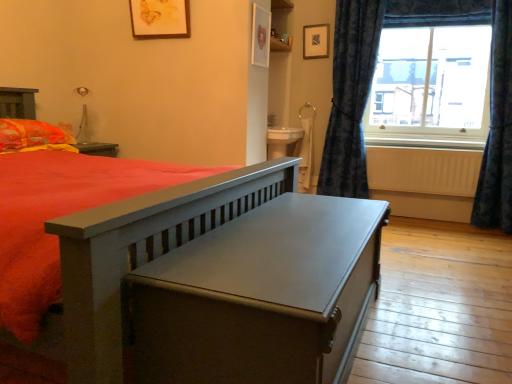
The width and height of the screenshot is (512, 384). I want to click on matte gray table at center, so click(x=259, y=296).

You are a GUI agent. You are given a task and a screenshot of the screen. Output one action in this format:
    pyautogui.click(x=<x>, y=<y>)
    Task: Click on the blue textured curtain at right, the second curtain viewed from the right
    
    Given the screenshot: What is the action you would take?
    pyautogui.click(x=350, y=97)

Where is `orange/yellow fabric pillow at left`? The width and height of the screenshot is (512, 384). orange/yellow fabric pillow at left is located at coordinates (31, 135).

In order to face orange/yellow fabric pillow at left, should I rotate leftwards or rightwards?

Turn left by 29.148 degrees to look at orange/yellow fabric pillow at left.

In order to face white painted wood at right, should I rotate leftwards or rightwards?

You should rotate right by 21.449 degrees.

You are a GUI agent. You are given a task and a screenshot of the screen. Output one action in this format:
    pyautogui.click(x=<x>, y=<y>)
    Task: Click on the matte gray table at center
    This screenshot has height=384, width=512.
    Given the screenshot: What is the action you would take?
    pyautogui.click(x=259, y=296)

Is blue textured curtain at right, the first curtain viewed from the left, beside clear glass window at upper right?

blue textured curtain at right, the first curtain viewed from the left, and clear glass window at upper right are not in contact.

Based on the photo, from the image's perspective, is blue textured curtain at right, the first curtain viewed from the left, below clear glass window at upper right?

Indeed, from the image's perspective, blue textured curtain at right, the first curtain viewed from the left, is shown beneath clear glass window at upper right.

From the picture: Does blue textured curtain at right, the first curtain viewed from the left, turn towards clear glass window at upper right?

No, blue textured curtain at right, the first curtain viewed from the left, is not turned towards clear glass window at upper right.

Between point (357, 182) and point (463, 108), which one is positioned behind?

The point (357, 182) is farther from the camera.

Considering the relative positions of white painted wood at right and matte wooden picture frame at upper center, the first picture frame positioned from the front, in the image provided, is white painted wood at right to the right of matte wooden picture frame at upper center, the first picture frame positioned from the front, from the viewer's perspective?

Indeed, white painted wood at right is positioned on the right side of matte wooden picture frame at upper center, the first picture frame positioned from the front.

At what (x,y) coordinates should I click in order to perform the action: click on window sill behind the matte wooden picture frame at upper center, placed as the first picture frame when sorted from left to right. Please return your answer as a coordinate pair (x, y). Image resolution: width=512 pixels, height=384 pixels. Looking at the image, I should click on (426, 141).

From the image's perspective, is white painted wood at right under matte wooden picture frame at upper center, which appears as the 2th picture frame when viewed from the back?

Yes, from the image's perspective, white painted wood at right is beneath matte wooden picture frame at upper center, which appears as the 2th picture frame when viewed from the back.

Is white painted wood at right in front of or behind matte wooden picture frame at upper center, which appears as the 2th picture frame when viewed from the back, in the image?

In the image, white painted wood at right appears behind matte wooden picture frame at upper center, which appears as the 2th picture frame when viewed from the back.

Is matte wooden picture frame at upper center, which appears as the 2th picture frame when viewed from the back, turned away from matte gray table at center?

No, matte wooden picture frame at upper center, which appears as the 2th picture frame when viewed from the back, is not facing away from matte gray table at center.

From the image's perspective, does matte wooden picture frame at upper center, placed as the first picture frame when sorted from left to right, appear lower than matte gray table at center?

Actually, matte wooden picture frame at upper center, placed as the first picture frame when sorted from left to right, appears above matte gray table at center in the image.

From the picture: Is matte wooden picture frame at upper center, placed as the first picture frame when sorted from left to right, positioned far away from matte gray table at center?

That's right, there is a large distance between matte wooden picture frame at upper center, placed as the first picture frame when sorted from left to right, and matte gray table at center.

Which is more to the right, dark blue fabric curtain at right, the first curtain in the right-to-left sequence, or matte black picture frame at upper center, the 2th picture frame viewed from the left?

→ Positioned to the right is dark blue fabric curtain at right, the first curtain in the right-to-left sequence.

From the image's perspective, between dark blue fabric curtain at right, the 2th curtain from the left, and matte black picture frame at upper center, which is the 2th picture frame in front-to-back order, which one is located above?

matte black picture frame at upper center, which is the 2th picture frame in front-to-back order, is shown above in the image.

Is dark blue fabric curtain at right, the 2th curtain from the left, positioned before matte black picture frame at upper center, which is the 2th picture frame in front-to-back order?

Yes, dark blue fabric curtain at right, the 2th curtain from the left, is closer to the viewer.

Can you tell me how much dark blue fabric curtain at right, the 2th curtain from the left, and matte black picture frame at upper center, which is the 2th picture frame in front-to-back order, differ in facing direction?

0.199 degrees.

Between matte wooden picture frame at upper center, which is counted as the 2th picture frame, starting from the right, and clear glass window at upper right, which one has less height?

Standing shorter between the two is matte wooden picture frame at upper center, which is counted as the 2th picture frame, starting from the right.

There is a clear glass window at upper right. Where is `the 2nd picture frame above it (from a real-world perspective)`? The height and width of the screenshot is (384, 512). the 2nd picture frame above it (from a real-world perspective) is located at coordinates (160, 19).

Is matte wooden picture frame at upper center, placed as the first picture frame when sorted from left to right, smaller than clear glass window at upper right?

Yes.

Would you consider matte wooden picture frame at upper center, which appears as the 2th picture frame when viewed from the back, to be distant from clear glass window at upper right?

Absolutely, matte wooden picture frame at upper center, which appears as the 2th picture frame when viewed from the back, is distant from clear glass window at upper right.

Could white painted wood at right be considered to be inside matte black picture frame at upper center, the 2th picture frame viewed from the left?

No, white painted wood at right is not inside matte black picture frame at upper center, the 2th picture frame viewed from the left.

From a real-world perspective, is matte black picture frame at upper center, the 2th picture frame viewed from the left, over white painted wood at right?

Yes, from a real-world perspective, matte black picture frame at upper center, the 2th picture frame viewed from the left, is above white painted wood at right.

Is matte black picture frame at upper center, positioned as the 1th picture frame in right-to-left order, beside white painted wood at right?

No, matte black picture frame at upper center, positioned as the 1th picture frame in right-to-left order, is not making contact with white painted wood at right.

How many degrees apart are the facing directions of matte black picture frame at upper center, the first picture frame viewed from the back, and white painted wood at right?

The facing directions of matte black picture frame at upper center, the first picture frame viewed from the back, and white painted wood at right are 0.15 degrees apart.

Is point (9, 146) farther from viewer compared to point (350, 126)?

No, (9, 146) is closer to viewer.

Can you tell me how much orange/yellow fabric pillow at left and blue textured curtain at right, the first curtain viewed from the left, differ in facing direction?

The angular difference between orange/yellow fabric pillow at left and blue textured curtain at right, the first curtain viewed from the left, is 88.6 degrees.

Visually, is orange/yellow fabric pillow at left positioned to the left or to the right of blue textured curtain at right, the second curtain viewed from the right?

From the image, it's evident that orange/yellow fabric pillow at left is to the left of blue textured curtain at right, the second curtain viewed from the right.

Considering their positions, is orange/yellow fabric pillow at left located in front of or behind blue textured curtain at right, the second curtain viewed from the right?

Clearly, orange/yellow fabric pillow at left is in front of blue textured curtain at right, the second curtain viewed from the right.

This screenshot has width=512, height=384. Identify the location of window above the blue textured curtain at right, the first curtain viewed from the left (from the image's perspective). (431, 83).

Locate an element on the screen. The width and height of the screenshot is (512, 384). the 2nd picture frame counting from the left side of the white painted wood at right is located at coordinates (160, 19).

Estimate the real-world distances between objects in this image. Which object is closer to white matte radiator at lower right, white painted wood at right or blue textured curtain at right, the second curtain viewed from the right?

white painted wood at right is closer to white matte radiator at lower right.

Consider the image. Based on their spatial positions, is matte gray table at center or matte wooden picture frame at upper center, placed as the first picture frame when sorted from left to right, further from dark blue fabric curtain at right, the 2th curtain from the left?

matte wooden picture frame at upper center, placed as the first picture frame when sorted from left to right.

Looking at the image, which one is located further to blue textured curtain at right, the second curtain viewed from the right, white painted wood at right or matte gray table at center?

Based on the image, matte gray table at center appears to be further to blue textured curtain at right, the second curtain viewed from the right.

From the picture: Based on their spatial positions, is matte black picture frame at upper center, the first picture frame viewed from the back, or orange/yellow fabric pillow at left further from clear glass window at upper right?

The object further to clear glass window at upper right is orange/yellow fabric pillow at left.

Considering their positions, is white matte radiator at lower right positioned further to white painted wood at right than matte black picture frame at upper center, positioned as the 1th picture frame in right-to-left order?

matte black picture frame at upper center, positioned as the 1th picture frame in right-to-left order, is positioned further to the anchor white painted wood at right.

Considering their positions, is matte wooden picture frame at upper center, placed as the first picture frame when sorted from left to right, positioned closer to white painted wood at right than blue textured curtain at right, the second curtain viewed from the right?

The object closer to white painted wood at right is blue textured curtain at right, the second curtain viewed from the right.

From the image, which object appears to be nearer to clear glass window at upper right, orange/yellow fabric pillow at left or white painted wood at right?

white painted wood at right lies closer to clear glass window at upper right than the other object.

Based on their spatial positions, is matte gray table at center or dark blue fabric curtain at right, the first curtain in the right-to-left sequence, further from matte wooden picture frame at upper center, the first picture frame positioned from the front?

dark blue fabric curtain at right, the first curtain in the right-to-left sequence, is further to matte wooden picture frame at upper center, the first picture frame positioned from the front.

The image size is (512, 384). What are the coordinates of `window sill between blue textured curtain at right, the first curtain viewed from the left, and clear glass window at upper right` in the screenshot? It's located at [426, 141].

Identify the location of radiator between blue textured curtain at right, the second curtain viewed from the right, and dark blue fabric curtain at right, the first curtain in the right-to-left sequence, in the horizontal direction. The image size is (512, 384). (423, 170).

Where is `table between orange/yellow fabric pillow at left and white painted wood at right from left to right`? The height and width of the screenshot is (384, 512). table between orange/yellow fabric pillow at left and white painted wood at right from left to right is located at coordinates (259, 296).

Image resolution: width=512 pixels, height=384 pixels. What are the coordinates of `curtain located between matte gray table at center and blue textured curtain at right, the first curtain viewed from the left, in the depth direction` in the screenshot? It's located at (497, 130).